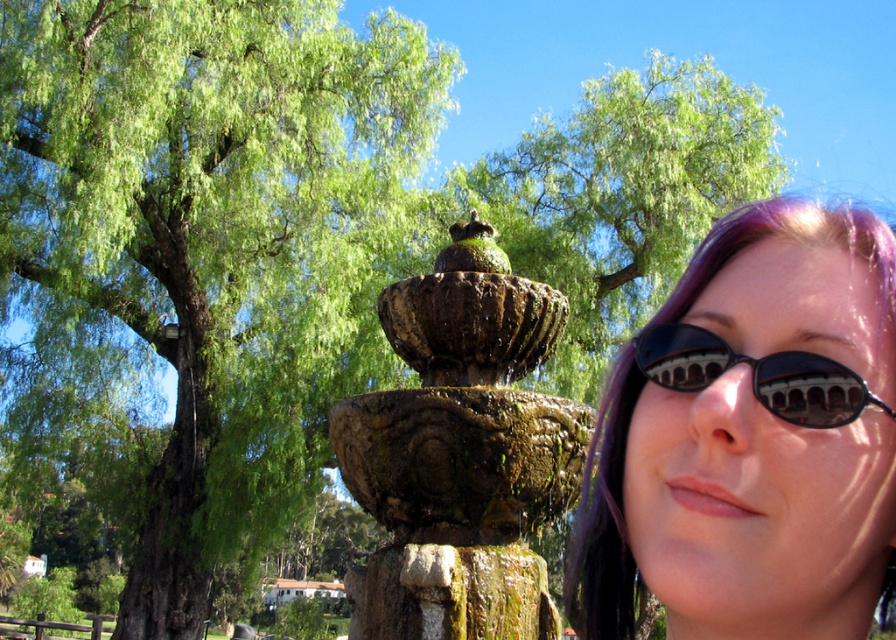
Consider the image. Who is higher up, green leafy tree at center or black reflective sunglasses at right?

green leafy tree at center

Is green leafy tree at center shorter than black reflective sunglasses at right?

In fact, green leafy tree at center may be taller than black reflective sunglasses at right.

Who is more forward, (533, 145) or (639, 355)?

Point (639, 355)

Image resolution: width=896 pixels, height=640 pixels. I want to click on green leafy tree at center, so click(x=622, y=196).

Locate an element on the screen. green leafy tree at upper left is located at coordinates (199, 256).

Is green leafy tree at upper left thinner than green leafy tree at center?

No, green leafy tree at upper left is not thinner than green leafy tree at center.

Measure the distance between point (40, 348) and camera.

Point (40, 348) and camera are 25.07 meters apart.

This screenshot has height=640, width=896. In order to click on green leafy tree at upper left in this screenshot , I will do `click(199, 256)`.

Is purple hair at center closer to the viewer compared to black reflective sunglasses at right?

No, it is not.

Measure the distance between point (618, 580) and camera.

The distance of point (618, 580) from camera is 11.82 feet.

Does point (743, 253) come farther from viewer compared to point (806, 426)?

Yes, it is.

Identify the location of purple hair at center. The width and height of the screenshot is (896, 640). click(751, 436).